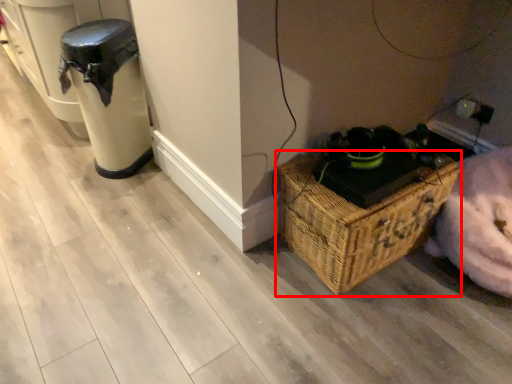
Question: Where is picnic basket (annotated by the red box) located in relation to appliance in the image?

Choices:
 (A) left
 (B) right

Answer: (B)